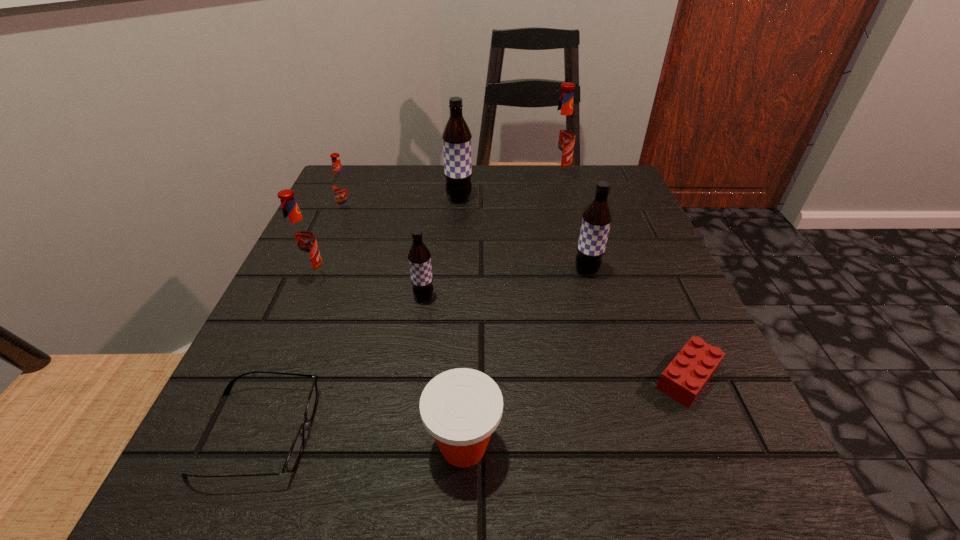
The height and width of the screenshot is (540, 960). I want to click on unoccupied area between the spectacles and the farthest object, so click(407, 306).

The width and height of the screenshot is (960, 540). Find the location of `vacant space that's between the third shortest object and the rightmost red root beer`. vacant space that's between the third shortest object and the rightmost red root beer is located at coordinates (510, 312).

The image size is (960, 540). In order to click on vacant area that lies between the second biggest red root beer and the second nearest brown root beer in this screenshot , I will do `click(450, 274)`.

Locate an element on the screen. vacant space in between the farthest object and the red Lego is located at coordinates (622, 278).

Locate an element on the screen. The image size is (960, 540). free space between the nearest brown root beer and the spectacles is located at coordinates (341, 364).

Locate an element on the screen. The height and width of the screenshot is (540, 960). empty space that is in between the red-orange Dixie cup and the nearest root beer is located at coordinates (444, 371).

The width and height of the screenshot is (960, 540). Identify the location of unoccupied position between the rightmost object and the fifth nearest root beer. [573, 288].

The width and height of the screenshot is (960, 540). I want to click on vacant area between the second biggest brown root beer and the red Lego, so click(637, 324).

At what (x,y) coordinates should I click in order to perform the action: click on object that is the closest to the rightmost object. Please return your answer as a coordinate pair (x, y). Image resolution: width=960 pixels, height=540 pixels. Looking at the image, I should click on (597, 217).

Select which object is the fifth closest to the rightmost brown root beer. Please provide its 2D coordinates. Your answer should be formatted as a tuple, i.e. [(x, y)], where the tuple contains the x and y coordinates of a point satisfying the conditions above.

[(461, 408)]